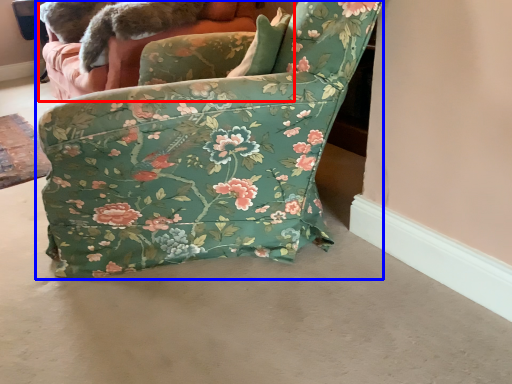
Question: Among these objects, which one is nearest to the camera, couch (highlighted by a red box) or chair (highlighted by a blue box)?

Choices:
 (A) couch
 (B) chair

Answer: (B)